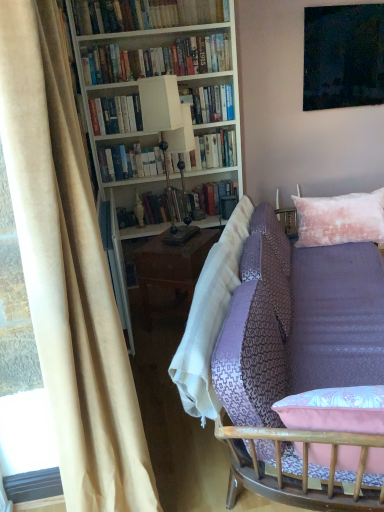
Question: Does pink textured pillow at upper right contain hardcover books at upper center, arranged as the third book when ordered from the bottom?

Choices:
 (A) yes
 (B) no

Answer: (B)

Question: Considering the relative sizes of pink textured pillow at upper right and hardcover books at upper center, arranged as the third book when ordered from the bottom, in the image provided, is pink textured pillow at upper right thinner than hardcover books at upper center, arranged as the third book when ordered from the bottom,?

Choices:
 (A) yes
 (B) no

Answer: (B)

Question: Does pink textured pillow at upper right lie in front of hardcover books at upper center, which is the 2th book from top to bottom?

Choices:
 (A) yes
 (B) no

Answer: (A)

Question: Is pink textured pillow at upper right looking in the opposite direction of hardcover books at upper center, arranged as the third book when ordered from the bottom?

Choices:
 (A) yes
 (B) no

Answer: (B)

Question: Can you confirm if pink textured pillow at upper right is taller than hardcover books at upper center, arranged as the third book when ordered from the bottom?

Choices:
 (A) yes
 (B) no

Answer: (A)

Question: Is hardcover books at upper center, the 1th book in the top-to-bottom sequence, bigger or smaller than pink textured pillow at upper right?

Choices:
 (A) big
 (B) small

Answer: (B)

Question: Is hardcover books at upper center, the 1th book in the top-to-bottom sequence, inside the boundaries of pink textured pillow at upper right, or outside?

Choices:
 (A) inside
 (B) outside

Answer: (B)

Question: From the image's perspective, is hardcover books at upper center, placed as the 4th book when sorted from bottom to top, above or below pink textured pillow at upper right?

Choices:
 (A) above
 (B) below

Answer: (A)

Question: From a real-world perspective, is hardcover books at upper center, the 1th book in the top-to-bottom sequence, positioned above or below pink textured pillow at upper right?

Choices:
 (A) below
 (B) above

Answer: (B)

Question: Considering the relative positions of white matte lamp at center and hardcover book at upper center, placed as the second book when sorted from bottom to top, in the image provided, is white matte lamp at center to the left or to the right of hardcover book at upper center, placed as the second book when sorted from bottom to top,?

Choices:
 (A) right
 (B) left

Answer: (B)

Question: Is point (178, 138) positioned closer to the camera than point (195, 115)?

Choices:
 (A) closer
 (B) farther

Answer: (A)

Question: Is white matte lamp at center inside or outside of hardcover book at upper center, the third book from the top?

Choices:
 (A) outside
 (B) inside

Answer: (A)

Question: From the image's perspective, is white matte lamp at center positioned above or below hardcover book at upper center, the third book from the top?

Choices:
 (A) below
 (B) above

Answer: (A)

Question: From the image's perspective, is hardcover books at upper center, which is the 2th book from top to bottom, located above or below purple fabric couch at lower right?

Choices:
 (A) below
 (B) above

Answer: (B)

Question: Is hardcover books at upper center, which is the 2th book from top to bottom, wider or thinner than purple fabric couch at lower right?

Choices:
 (A) thin
 (B) wide

Answer: (A)